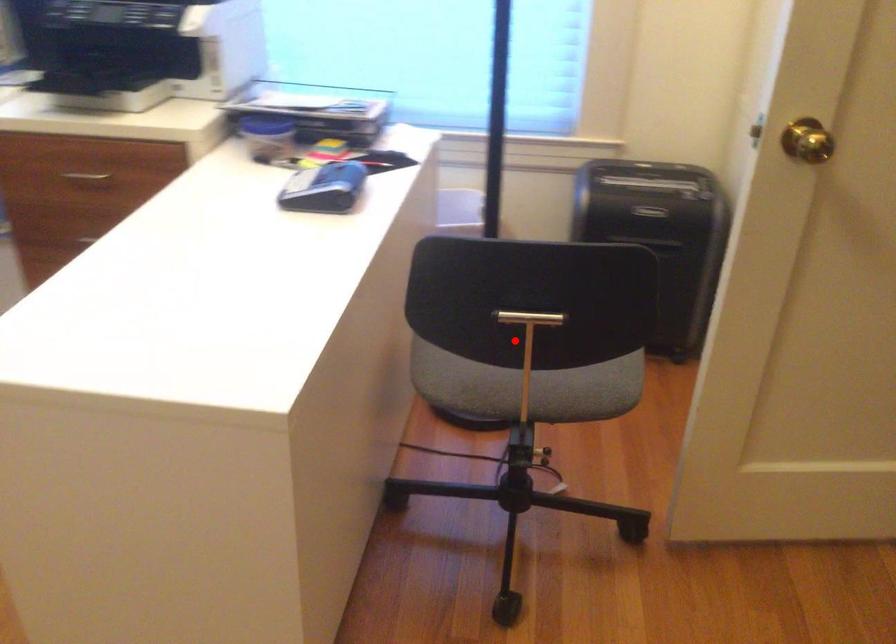
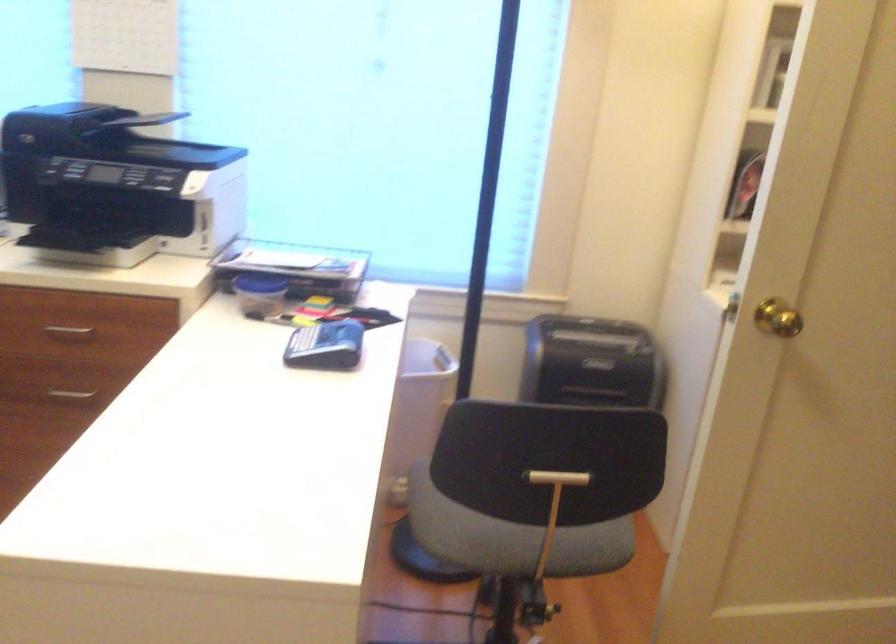
Find the pixel in the second image that matches the highlighted location in the first image.

(535, 495)